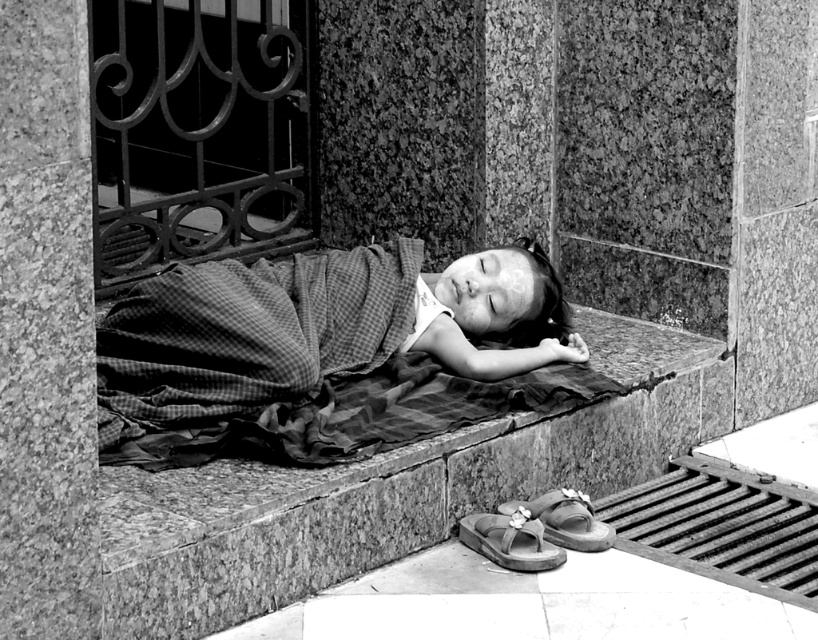
Question: Is checkered fabric blanket at center closer to the viewer compared to checkered fabric blanket at lower center?

Choices:
 (A) no
 (B) yes

Answer: (A)

Question: Does checkered fabric blanket at lower center come behind matte brown flip-flop at lower center?

Choices:
 (A) yes
 (B) no

Answer: (B)

Question: Does matte brown flip-flop at lower center have a lesser width compared to leather sandal at lower center?

Choices:
 (A) no
 (B) yes

Answer: (B)

Question: Based on their relative distances, which object is farther from the checkered fabric blanket at lower center?

Choices:
 (A) checkered fabric blanket at center
 (B) smooth concrete pavement at lower center
 (C) leather sandal at lower center

Answer: (B)

Question: Which object is farther from the camera taking this photo?

Choices:
 (A) smooth concrete pavement at lower center
 (B) matte brown flip-flop at lower center
 (C) checkered fabric blanket at lower center
 (D) checkered fabric blanket at center

Answer: (B)

Question: Which object appears closest to the camera in this image?

Choices:
 (A) smooth concrete pavement at lower center
 (B) matte brown flip-flop at lower center
 (C) checkered fabric blanket at lower center
 (D) checkered fabric blanket at center

Answer: (A)